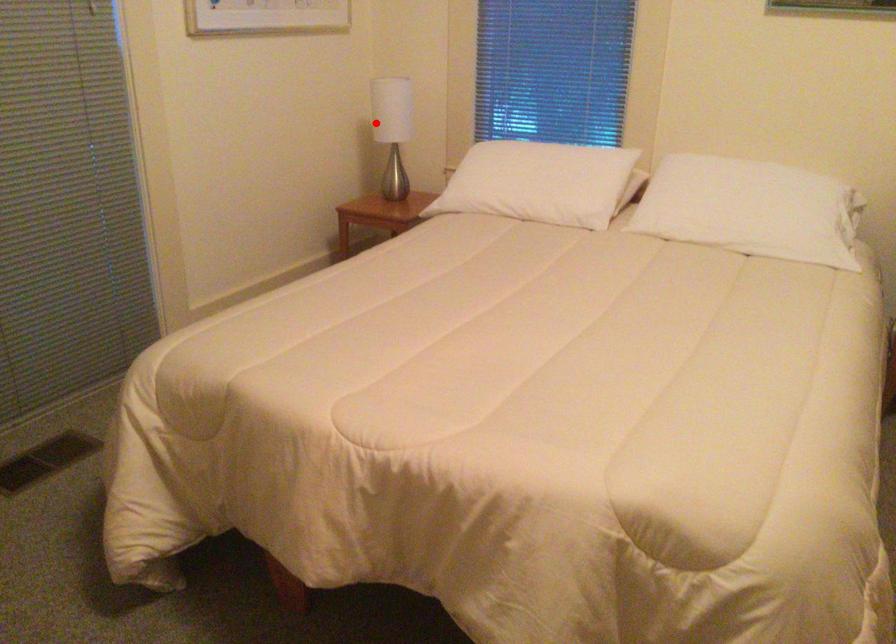
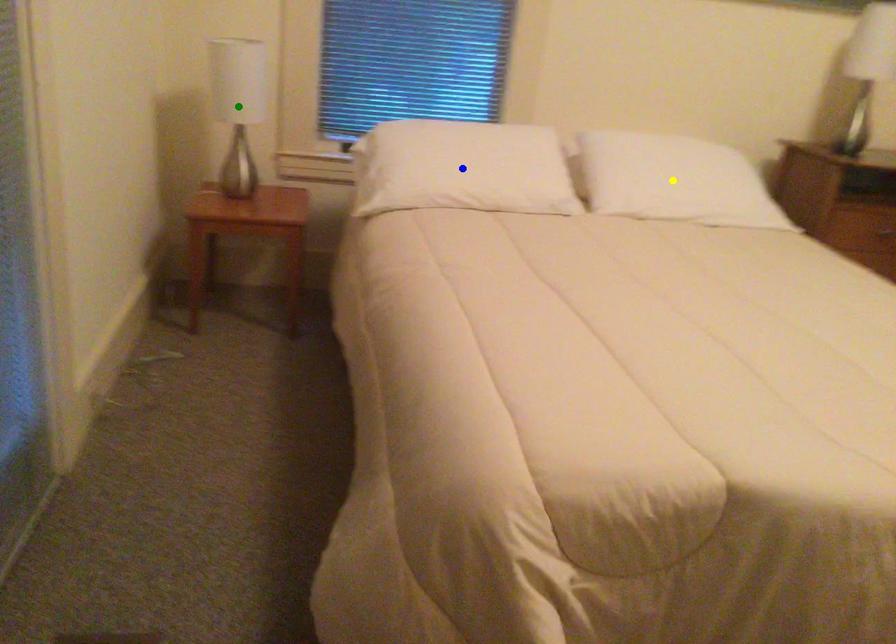
Question: I am providing you with two images of the same scene from different viewpoints. A red point is marked on the first image. You are given multiple points on the second image. Which point in image 2 is actually the same real-world point as the red point in image 1?

Choices:
 (A) yellow point
 (B) green point
 (C) blue point

Answer: (B)